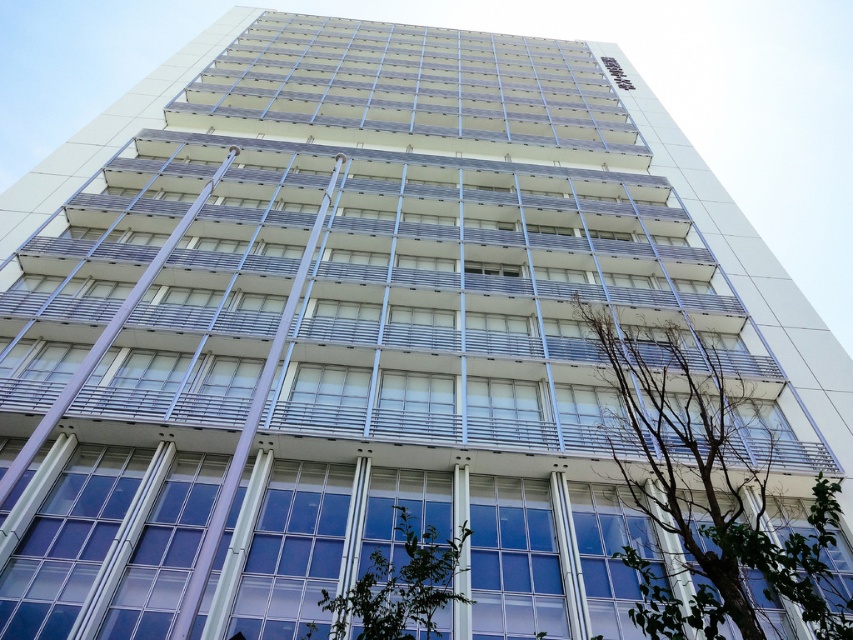
Can you confirm if green leafy tree at right is shorter than green leafy tree at center?

In fact, green leafy tree at right may be taller than green leafy tree at center.

Between green leafy tree at right and green leafy tree at center, which one is positioned higher?

Positioned higher is green leafy tree at right.

Is point (672, 417) closer to viewer compared to point (461, 593)?

No, it is behind (461, 593).

You are a GUI agent. You are given a task and a screenshot of the screen. Output one action in this format:
    pyautogui.click(x=<x>, y=<y>)
    Task: Click on the green leafy tree at right
    This screenshot has height=640, width=853.
    Given the screenshot: What is the action you would take?
    pyautogui.click(x=711, y=492)